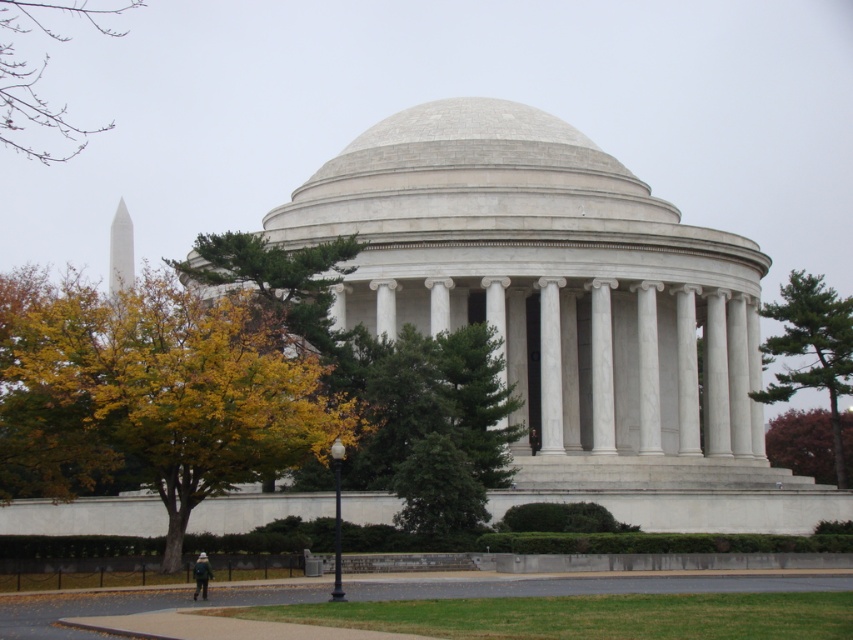
Between point (107, 460) and point (801, 365), which one is positioned in front?

Point (107, 460) is in front.

From the picture: Can you confirm if yellow-green leaves at left is positioned above green leafy tree at right?

Indeed, yellow-green leaves at left is positioned over green leafy tree at right.

Is point (9, 392) positioned in front of point (833, 294)?

That is True.

This screenshot has width=853, height=640. What are the coordinates of `yellow-green leaves at left` in the screenshot? It's located at (154, 394).

Is point (136, 301) closer to camera compared to point (747, 436)?

Yes, it is.

Is yellow-green leaves at left bigger than white marble pillar at center?

Yes.

Who is more forward, (x=4, y=324) or (x=749, y=442)?

Point (x=4, y=324) is in front.

At what (x,y) coordinates should I click in order to perform the action: click on yellow-green leaves at left. Please return your answer as a coordinate pair (x, y). Image resolution: width=853 pixels, height=640 pixels. Looking at the image, I should click on (154, 394).

Can you confirm if green leafy tree at upper left is positioned to the left of white marble pillar at center?

Indeed, green leafy tree at upper left is positioned on the left side of white marble pillar at center.

Where is `green leafy tree at upper left`? green leafy tree at upper left is located at coordinates (38, 77).

You are a GUI agent. You are given a task and a screenshot of the screen. Output one action in this format:
    pyautogui.click(x=<x>, y=<y>)
    Task: Click on the green leafy tree at upper left
    The width and height of the screenshot is (853, 640).
    Given the screenshot: What is the action you would take?
    pyautogui.click(x=38, y=77)